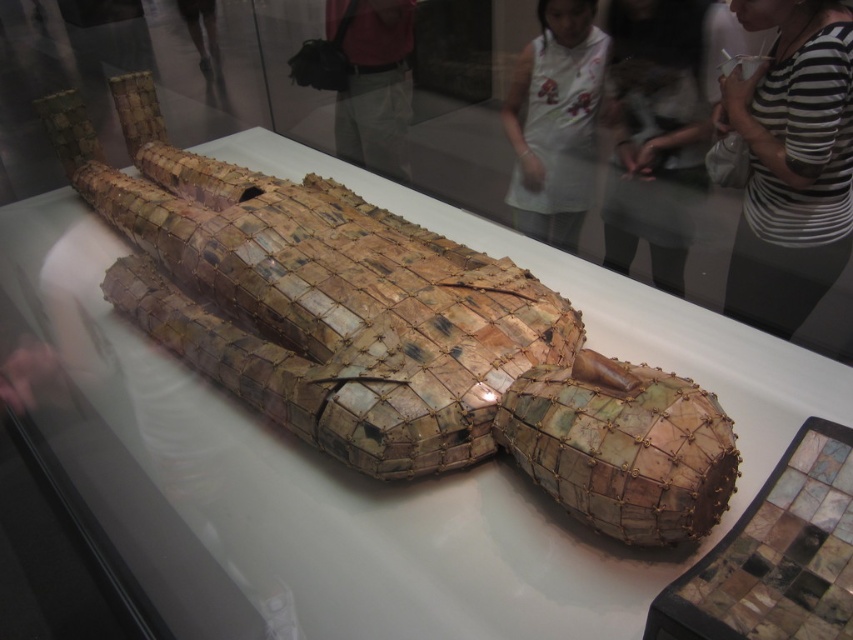
You are a museum visitor standing in front of the exhibit. You notice two points on the figure displayed on the table. The first point is at coordinates point (166, 188) and the second is at point (569, 193). Which point is closer to you?

Point (166, 188) is further to the camera than point (569, 193), so the point closer to you is point (569, 193).

You are a visitor at the museum and want to take a photo of the shiny metallic mosaic crocodile at center without any obstructions. Is the white apron at upper center blocking your view of it?

The shiny metallic mosaic crocodile at center is positioned under the white apron at upper center, so the white apron at upper center is blocking the view of the crocodile. Move to a position where the apron is not in front of the crocodile to take an unobstructed photo.